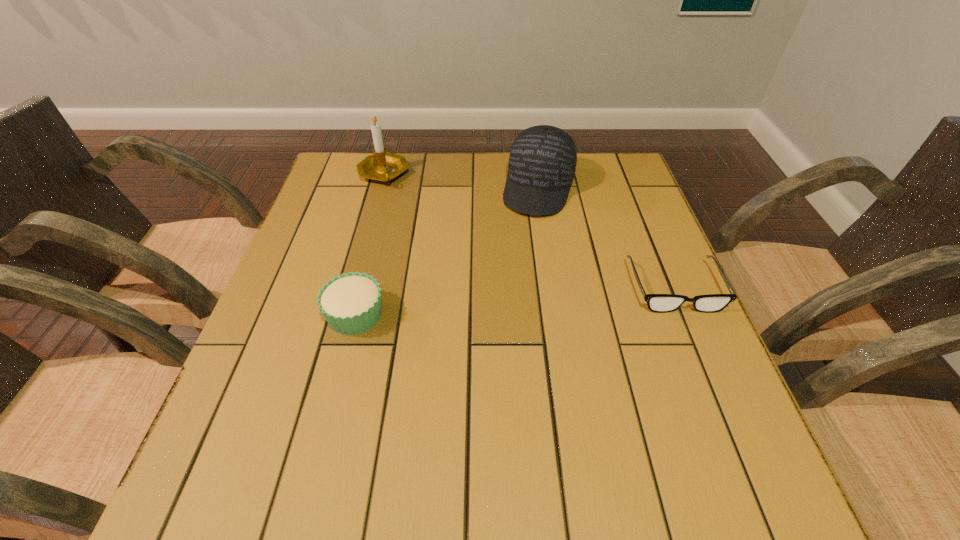
In the image, there is a desktop. In order to click on vacant region at the left edge in this screenshot , I will do `click(291, 259)`.

I want to click on vacant region at the right edge of the desktop, so click(x=613, y=297).

Locate an element on the screen. The width and height of the screenshot is (960, 540). free space at the near left corner of the desktop is located at coordinates (256, 411).

Image resolution: width=960 pixels, height=540 pixels. I want to click on vacant space at the far right corner of the desktop, so click(624, 159).

The width and height of the screenshot is (960, 540). I want to click on free space at the near right corner of the desktop, so (x=675, y=400).

The height and width of the screenshot is (540, 960). I want to click on free space between the candle holder and the spectacles, so click(529, 231).

The image size is (960, 540). Identify the location of empty location between the baseball cap and the rightmost object. (607, 238).

Identify the location of unoccupied area between the candle holder and the baseball cap. Image resolution: width=960 pixels, height=540 pixels. (461, 181).

Locate an element on the screen. The height and width of the screenshot is (540, 960). vacant space that is in between the candle holder and the second shortest object is located at coordinates (370, 245).

Locate an element on the screen. The image size is (960, 540). vacant point located between the cupcake and the shortest object is located at coordinates (515, 301).